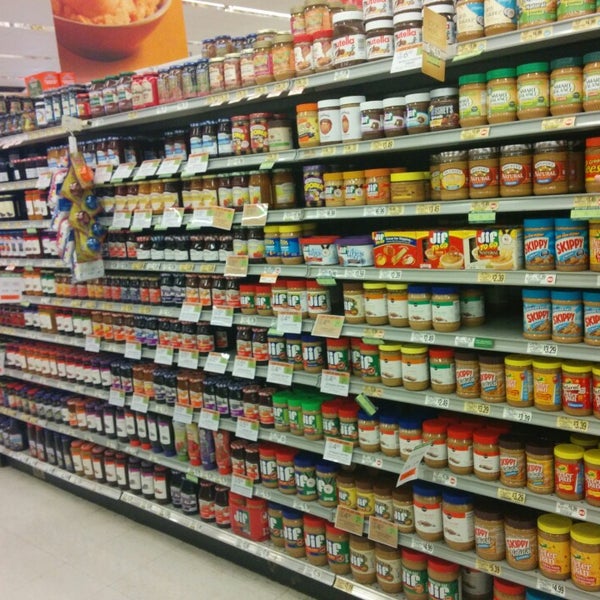
Locate an element on the screen. The image size is (600, 600). floor is located at coordinates (115, 550).